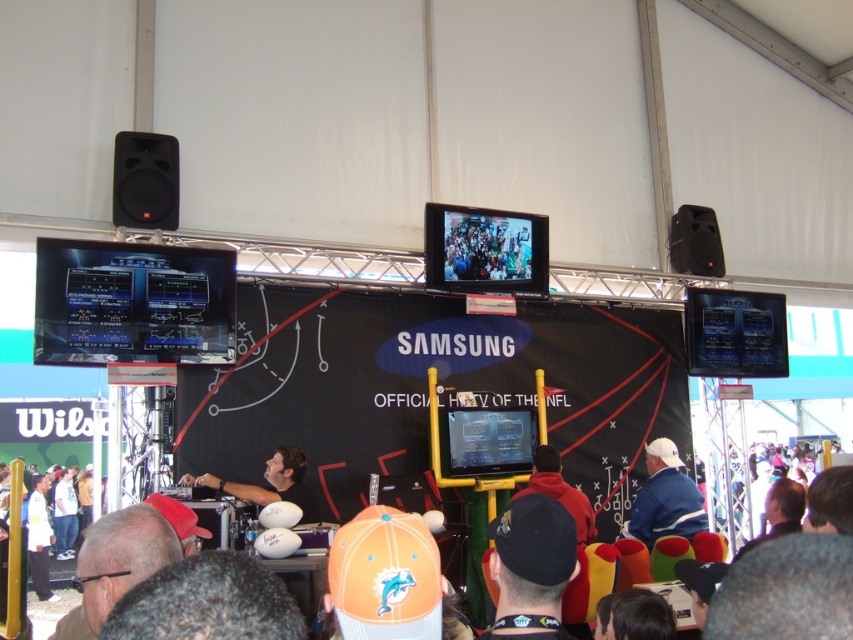
Is dark gray hair at lower left above blue fabric jacket at lower right?

Indeed, dark gray hair at lower left is positioned over blue fabric jacket at lower right.

Is dark gray hair at lower left shorter than blue fabric jacket at lower right?

Yes, dark gray hair at lower left is shorter than blue fabric jacket at lower right.

Is point (119, 513) less distant than point (701, 525)?

Yes, point (119, 513) is closer to viewer.

This screenshot has width=853, height=640. I want to click on dark gray hair at lower left, so click(x=115, y=564).

Describe the element at coordinates (665, 499) in the screenshot. This screenshot has width=853, height=640. I see `blue fabric jacket at lower right` at that location.

Who is more forward, (679,532) or (697,259)?

Point (679,532)

The width and height of the screenshot is (853, 640). I want to click on blue fabric jacket at lower right, so click(665, 499).

I want to click on blue fabric jacket at lower right, so click(665, 499).

Does dark gray hair at lower left appear on the left side of black matte speaker at upper left?

Incorrect, dark gray hair at lower left is not on the left side of black matte speaker at upper left.

Can you confirm if dark gray hair at lower left is positioned above black matte speaker at upper left?

No.

Find the location of `dark gray hair at lower left`. dark gray hair at lower left is located at coordinates (115, 564).

Where is `dark gray hair at lower left`? The height and width of the screenshot is (640, 853). dark gray hair at lower left is located at coordinates (115, 564).